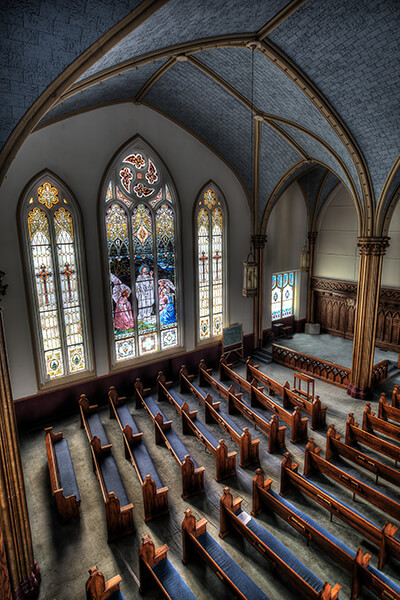
The height and width of the screenshot is (600, 400). What are the coordinates of `bench` in the screenshot? It's located at (310, 581).